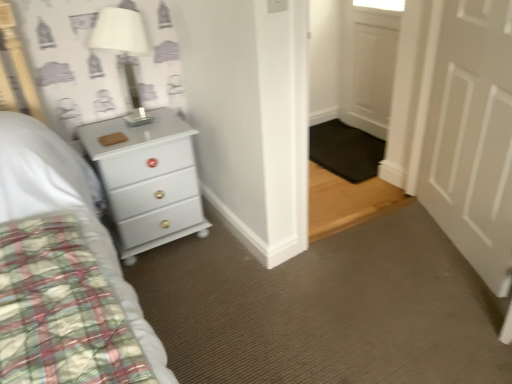
Question: Considering their positions, is white wooden door at upper right, the 1th door from the back, located in front of or behind white glossy chest of drawers at left?

Choices:
 (A) behind
 (B) front

Answer: (A)

Question: Is white wooden door at upper right, the 1th door from the back, taller or shorter than white glossy chest of drawers at left?

Choices:
 (A) short
 (B) tall

Answer: (B)

Question: Which of these objects is positioned farthest from the white matte lampshade at upper left?

Choices:
 (A) white glossy chest of drawers at left
 (B) white matte door at right, which is counted as the second door, starting from the back
 (C) white wooden door at upper right, the second door positioned from the front

Answer: (C)

Question: Which of these objects is positioned farthest from the white matte lampshade at upper left?

Choices:
 (A) white matte door at right, which is counted as the second door, starting from the back
 (B) white glossy chest of drawers at left
 (C) white wooden door at upper right, the second door positioned from the front

Answer: (C)